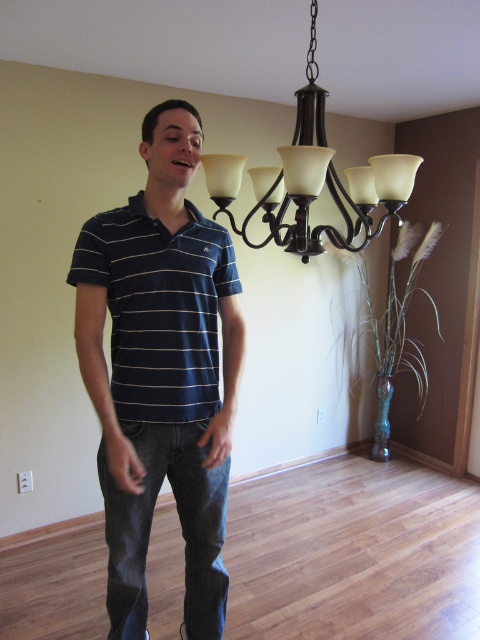
Is dark blue striped polo shirt at center smaller than navy striped polo shirt at center?

Incorrect, dark blue striped polo shirt at center is not smaller in size than navy striped polo shirt at center.

Between dark blue striped polo shirt at center and navy striped polo shirt at center, which one is positioned higher?

navy striped polo shirt at center

This screenshot has height=640, width=480. I want to click on dark blue striped polo shirt at center, so click(x=160, y=372).

Which is below, dark blue striped polo shirt at center or matte black chandelier at upper center?

Positioned lower is dark blue striped polo shirt at center.

Measure the distance between point (181,269) and camera.

They are 5.02 feet apart.

Who is more distant from viewer, (183, 205) or (313, 148)?

Positioned behind is point (183, 205).

Locate an element on the screen. dark blue striped polo shirt at center is located at coordinates (160, 372).

Which is above, navy striped polo shirt at center or matte black chandelier at upper center?

matte black chandelier at upper center

Where is `navy striped polo shirt at center`? navy striped polo shirt at center is located at coordinates (158, 307).

I want to click on navy striped polo shirt at center, so click(158, 307).